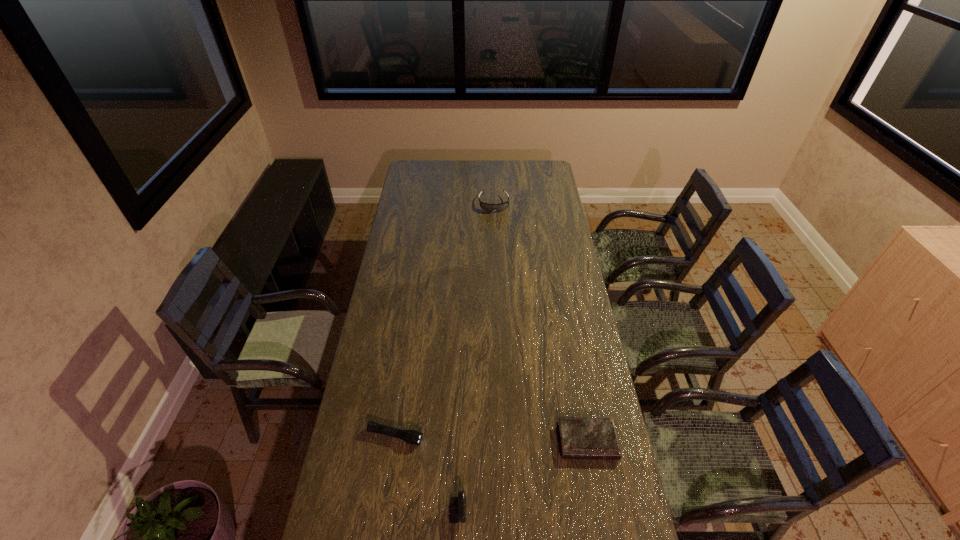
Image resolution: width=960 pixels, height=540 pixels. I want to click on vacant spot on the desktop that is between the nearest object and the diary and is positioned at the lens end of the flashlight, so pos(525,469).

Find the location of a particular element. free spot on the desktop that is between the webcam and the diary and is positioned on the front and sides of the farthest object is located at coordinates (520, 471).